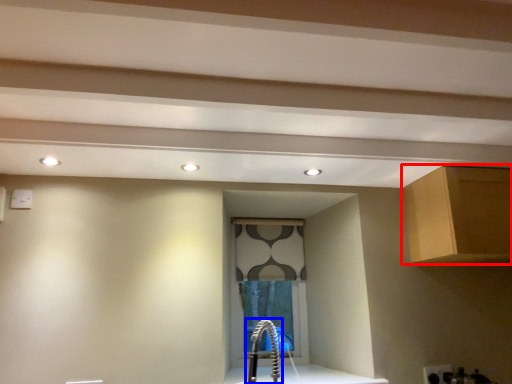
Question: Which object is closer to the camera taking this photo, cabinetry (highlighted by a red box) or faucet (highlighted by a blue box)?

Choices:
 (A) cabinetry
 (B) faucet

Answer: (B)